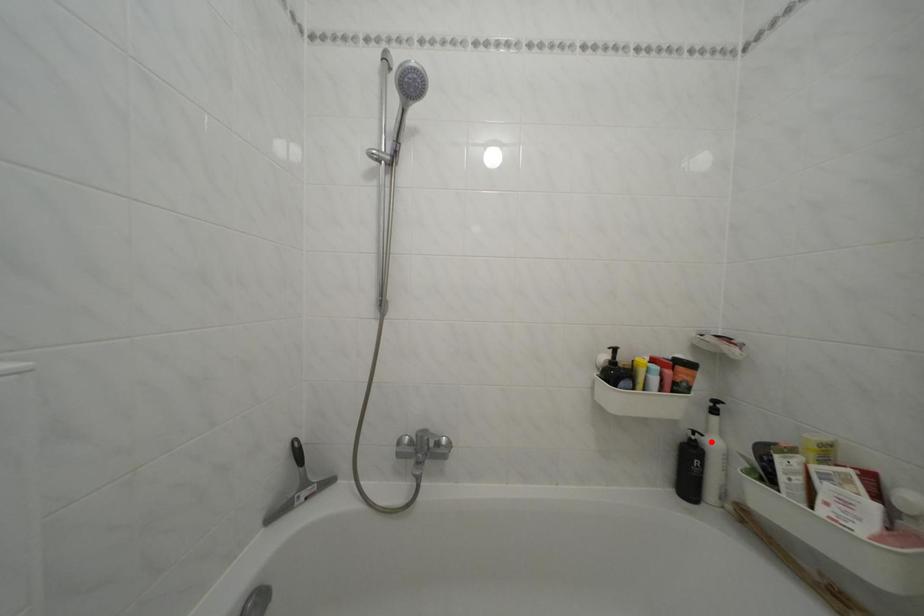
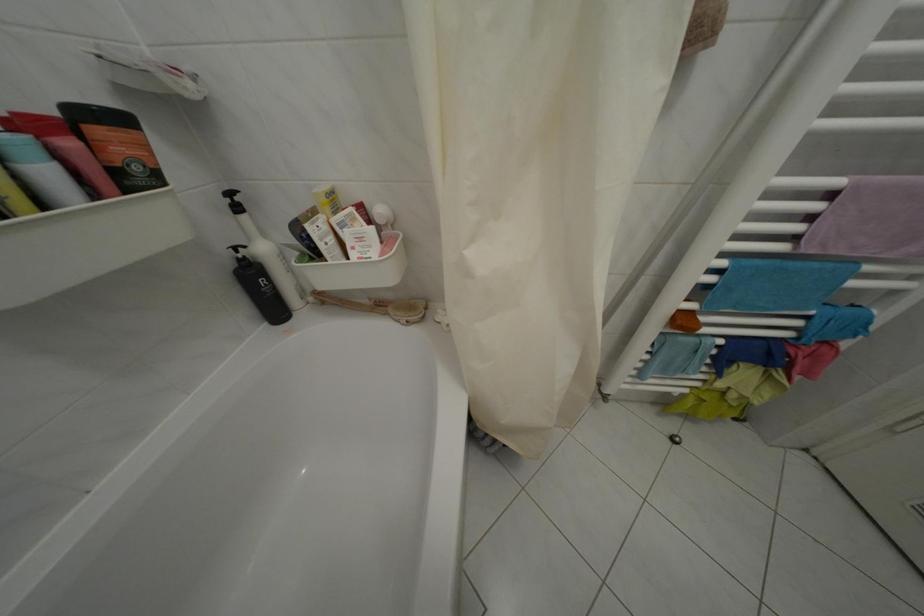
Find the pixel in the second image that matches the highlighted location in the first image.

(253, 254)